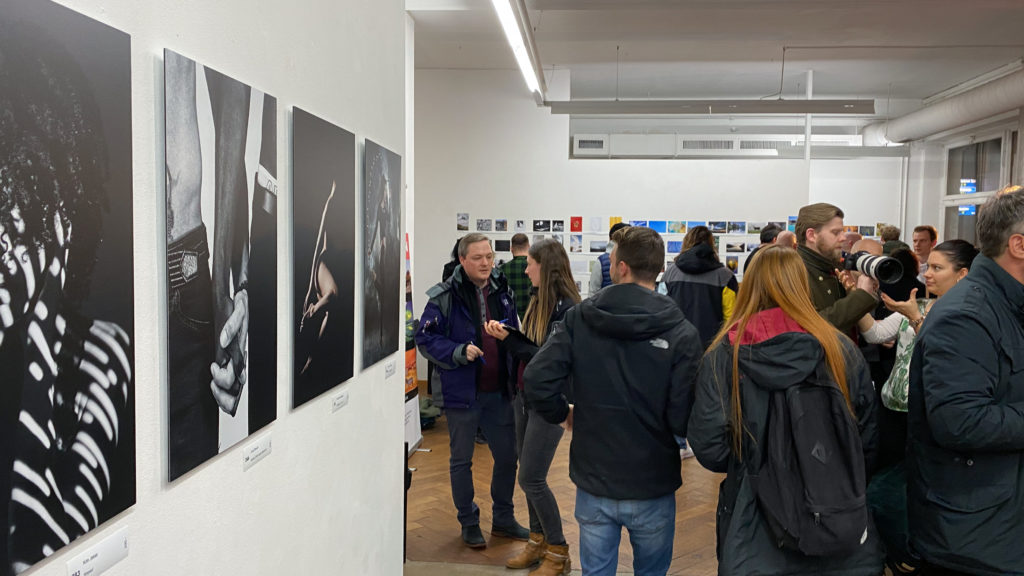
Find the location of `window`. window is located at coordinates (981, 168), (965, 228).